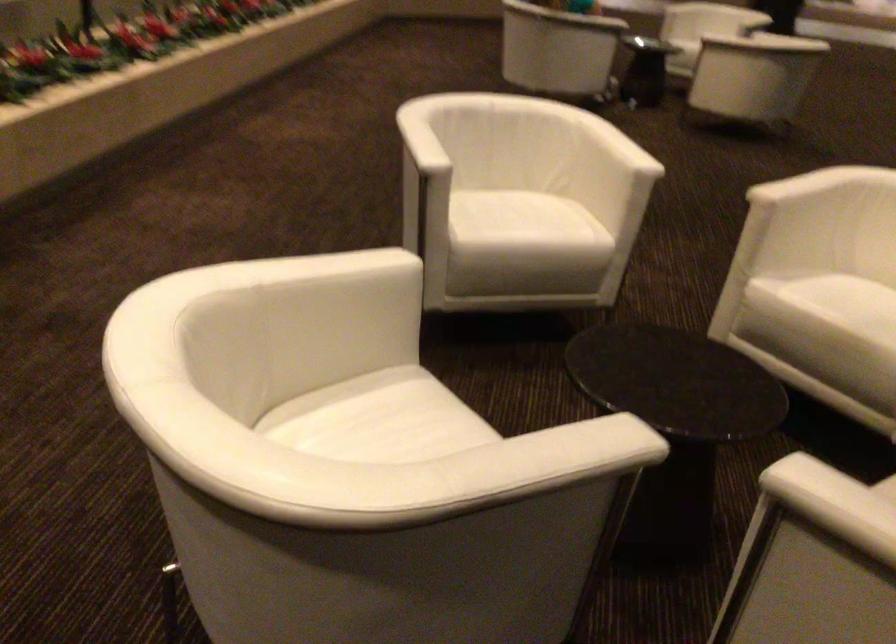
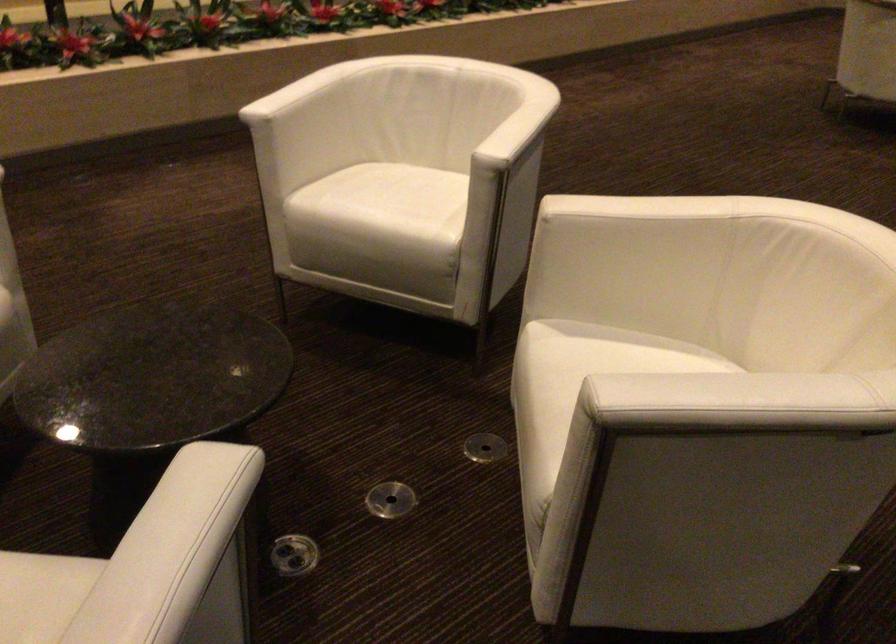
The point at (532, 225) is marked in the first image. Where is the corresponding point in the second image?

(383, 205)